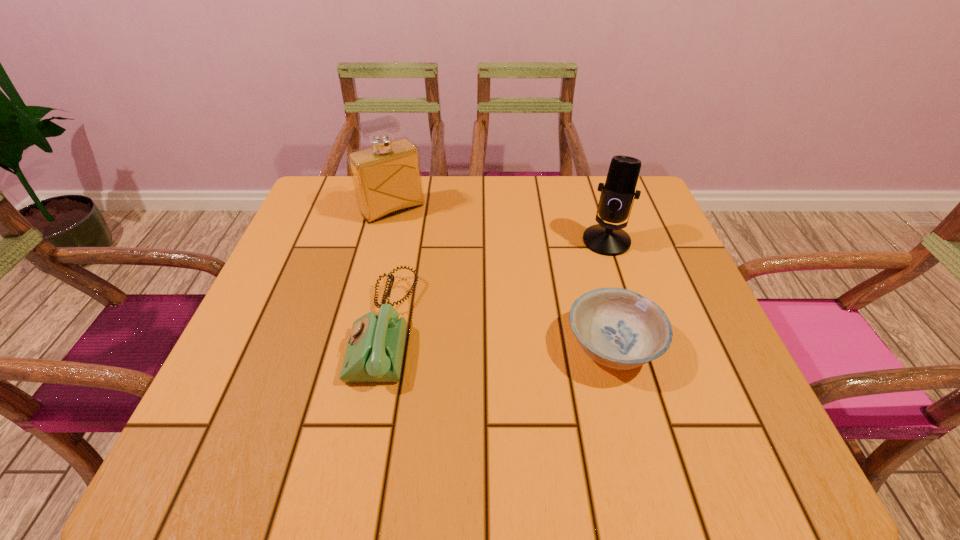
This screenshot has width=960, height=540. What are the coordinates of `vacant space on the desktop that is between the telephone and the bowl and is positioned on the front-facing side of the perfume` in the screenshot? It's located at (497, 336).

Find the location of a particular element. vacant spot on the desktop that is between the telephone and the bowl and is positioned on the stand of the microphone is located at coordinates (530, 340).